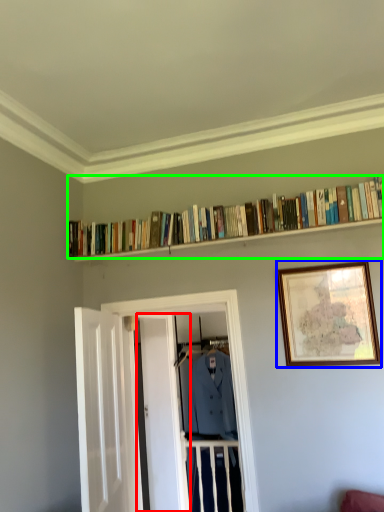
Question: Which object is the closest to the door (highlighted by a red box)? Choose among these: picture frame (highlighted by a blue box) or book (highlighted by a green box).

Choices:
 (A) picture frame
 (B) book

Answer: (B)